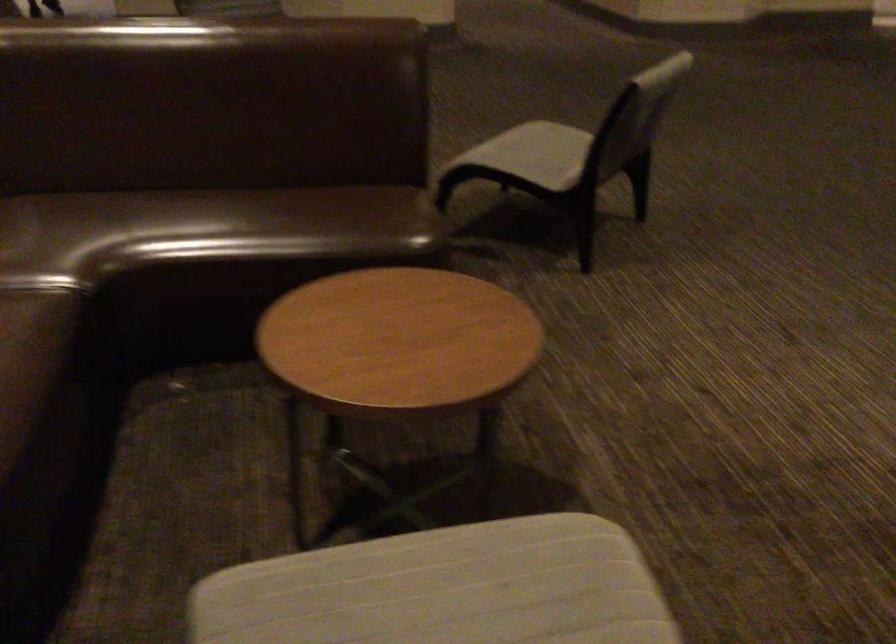
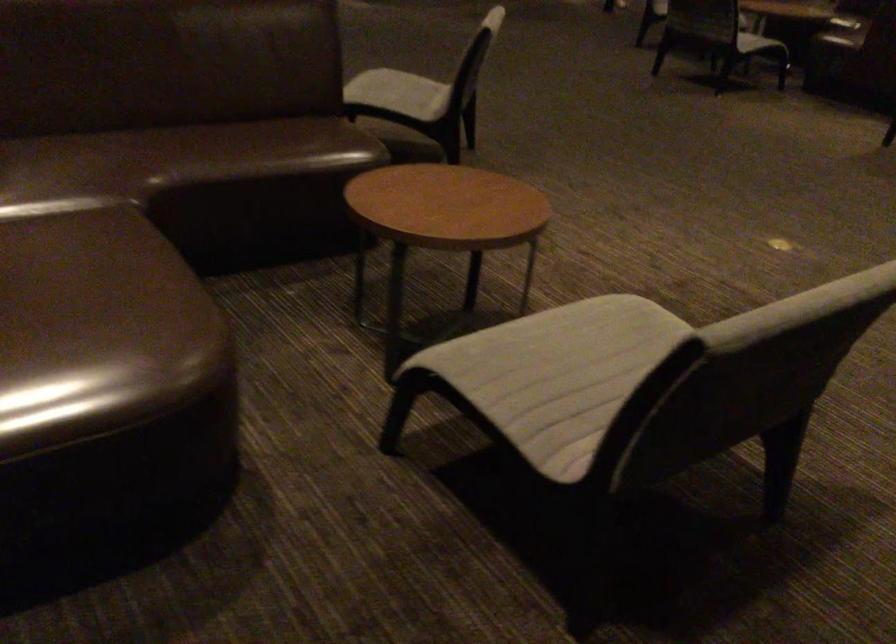
Which direction would the cameraman need to move to produce the second image?

The cameraman moved toward left, backward.